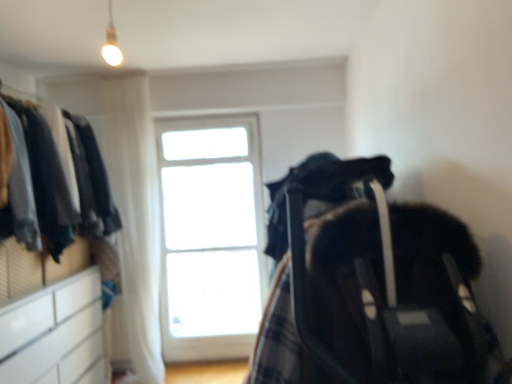
Measure the distance between point (54,378) and camera.

The depth of point (54,378) is 8.35 feet.

What is the approximate height of dark fabric baby carriage at right?

The height of dark fabric baby carriage at right is 37.63 inches.

Where is `dark fabric baby carriage at right`? dark fabric baby carriage at right is located at coordinates (374, 291).

Image resolution: width=512 pixels, height=384 pixels. What do you see at coordinates (211, 236) in the screenshot?
I see `white glass window at center` at bounding box center [211, 236].

Measure the distance between white glossy/file cabinet at lower left and camera.

A distance of 2.03 meters exists between white glossy/file cabinet at lower left and camera.

Where is `white glossy dresser at left`? white glossy dresser at left is located at coordinates (49, 264).

Which is more to the left, white sheer curtain at upper left or white glossy/file cabinet at lower left?

From the viewer's perspective, white glossy/file cabinet at lower left appears more on the left side.

Considering the positions of objects white sheer curtain at upper left and white glossy/file cabinet at lower left in the image provided, who is behind, white sheer curtain at upper left or white glossy/file cabinet at lower left?

white sheer curtain at upper left.

From a real-world perspective, which object stands above the other?

From a 3D spatial view, white sheer curtain at upper left is above.

Can we say white sheer curtain at upper left lies outside white glossy/file cabinet at lower left?

Yes, white sheer curtain at upper left is located beyond the bounds of white glossy/file cabinet at lower left.

Which object is positioned more to the right, white sheer curtain at upper left or dark fabric baby carriage at right?

dark fabric baby carriage at right is more to the right.

Between white sheer curtain at upper left and dark fabric baby carriage at right, which one has larger size?

Bigger between the two is dark fabric baby carriage at right.

Who is shorter, white sheer curtain at upper left or dark fabric baby carriage at right?

Standing shorter between the two is dark fabric baby carriage at right.

How different are the orientations of white glossy dresser at left and white glossy/file cabinet at lower left in degrees?

There is a 1.07-degree angle between the facing directions of white glossy dresser at left and white glossy/file cabinet at lower left.

Between white glossy dresser at left and white glossy/file cabinet at lower left, which one appears on the left side from the viewer's perspective?

Positioned to the left is white glossy/file cabinet at lower left.

Which of these two, white glossy dresser at left or white glossy/file cabinet at lower left, is wider?

white glossy dresser at left.

Considering the sizes of objects white glass window at center and white glossy dresser at left in the image provided, who is wider, white glass window at center or white glossy dresser at left?

Wider between the two is white glossy dresser at left.

Is white glass window at center smaller than white glossy dresser at left?

Yes, white glass window at center is smaller than white glossy dresser at left.

Does point (184, 183) appear closer or farther from the camera than point (10, 365)?

Point (184, 183) appears to be farther away from the viewer than point (10, 365).

Who is taller, white glass window at center or white glossy dresser at left?

white glass window at center is taller.

Consider the image. Based on their sizes in the image, would you say dark fabric baby carriage at right is bigger or smaller than white glossy/file cabinet at lower left?

dark fabric baby carriage at right is bigger than white glossy/file cabinet at lower left.

Based on the photo, who is shorter, dark fabric baby carriage at right or white glossy/file cabinet at lower left?

Standing shorter between the two is white glossy/file cabinet at lower left.

Is point (434, 351) behind point (23, 304)?

No, it is not.

Image resolution: width=512 pixels, height=384 pixels. What are the coordinates of `file cabinet below the dark fabric baby carriage at right (from the image's perspective)` in the screenshot? It's located at (53, 332).

Which of these two, white sheer curtain at upper left or white glass window at center, is thinner?

white glass window at center is thinner.

Which point is more distant from viewer, (156, 316) or (221, 126)?

Positioned behind is point (221, 126).

From the image's perspective, which one is positioned higher, white sheer curtain at upper left or white glass window at center?

white sheer curtain at upper left.

Is white sheer curtain at upper left not close to white glass window at center?

white sheer curtain at upper left is actually quite close to white glass window at center.

Is white glossy dresser at left behind dark fabric baby carriage at right?

That is True.

From a real-world perspective, which object rests below the other?

dark fabric baby carriage at right, from a real-world perspective.

In the image, there is a dark fabric baby carriage at right. Identify the location of dresser above it (from the image's perspective). (49, 264).

Can you confirm if white glossy dresser at left is taller than dark fabric baby carriage at right?

Yes.

You are a GUI agent. You are given a task and a screenshot of the screen. Output one action in this format:
    pyautogui.click(x=<x>, y=<y>)
    Task: Click on the file cabinet that is under the white sheer curtain at upper left (from a real-world perspective)
    
    Given the screenshot: What is the action you would take?
    pyautogui.click(x=53, y=332)

Where is `curtain behind the dark fabric baby carriage at right`? Image resolution: width=512 pixels, height=384 pixels. curtain behind the dark fabric baby carriage at right is located at coordinates (136, 218).

Considering their positions, is white glossy dresser at left positioned closer to white glossy/file cabinet at lower left than dark fabric baby carriage at right?

white glossy dresser at left is positioned closer to the anchor white glossy/file cabinet at lower left.

Estimate the real-world distances between objects in this image. Which object is further from dark fabric baby carriage at right, white glossy dresser at left or white glass window at center?

white glass window at center is further to dark fabric baby carriage at right.

Which object lies further to the anchor point white glossy/file cabinet at lower left, white glass window at center or white sheer curtain at upper left?

white glass window at center is positioned further to the anchor white glossy/file cabinet at lower left.

Considering their positions, is white sheer curtain at upper left positioned closer to dark fabric baby carriage at right than white glossy dresser at left?

white glossy dresser at left.

Estimate the real-world distances between objects in this image. Which object is closer to white sheer curtain at upper left, dark fabric baby carriage at right or white glass window at center?

white glass window at center.

Looking at the image, which one is located further to white glass window at center, white glossy/file cabinet at lower left or white glossy dresser at left?

white glossy/file cabinet at lower left.

From the image, which object appears to be nearer to white glass window at center, white glossy dresser at left or dark fabric baby carriage at right?

white glossy dresser at left is positioned closer to the anchor white glass window at center.

Estimate the real-world distances between objects in this image. Which object is further from white glass window at center, dark fabric baby carriage at right or white sheer curtain at upper left?

Based on the image, dark fabric baby carriage at right appears to be further to white glass window at center.

You are a GUI agent. You are given a task and a screenshot of the screen. Output one action in this format:
    pyautogui.click(x=<x>, y=<y>)
    Task: Click on the dresser situated between white glossy/file cabinet at lower left and dark fabric baby carriage at right from left to right
    The width and height of the screenshot is (512, 384).
    Given the screenshot: What is the action you would take?
    pyautogui.click(x=49, y=264)

I want to click on curtain between dark fabric baby carriage at right and white glass window at center in the front-back direction, so coord(136,218).

Where is `curtain between white glossy dresser at left and white glass window at center in the front-back direction`? This screenshot has width=512, height=384. curtain between white glossy dresser at left and white glass window at center in the front-back direction is located at coordinates (136, 218).

You are a GUI agent. You are given a task and a screenshot of the screen. Output one action in this format:
    pyautogui.click(x=<x>, y=<y>)
    Task: Click on the file cabinet located between dark fabric baby carriage at right and white glass window at center in the depth direction
    Image resolution: width=512 pixels, height=384 pixels.
    Given the screenshot: What is the action you would take?
    pyautogui.click(x=53, y=332)